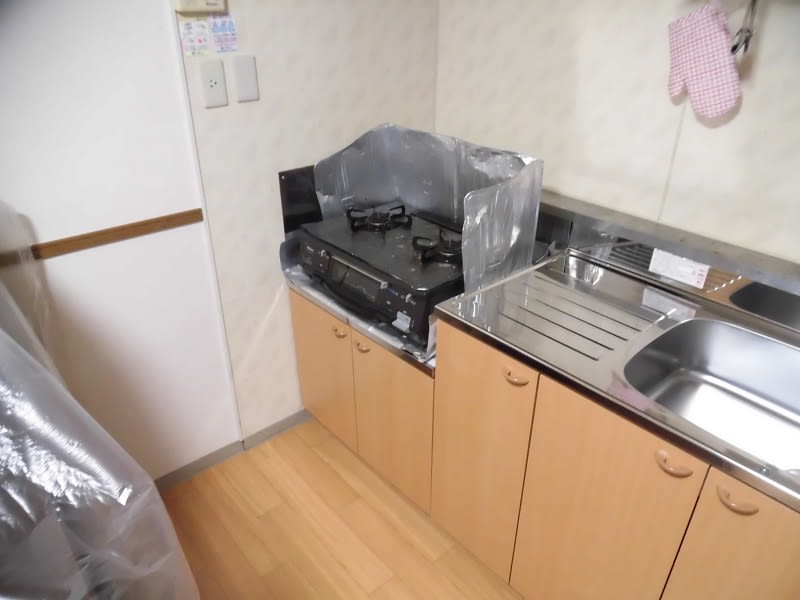
Find the location of `baseboard`. baseboard is located at coordinates (230, 451), (273, 431).